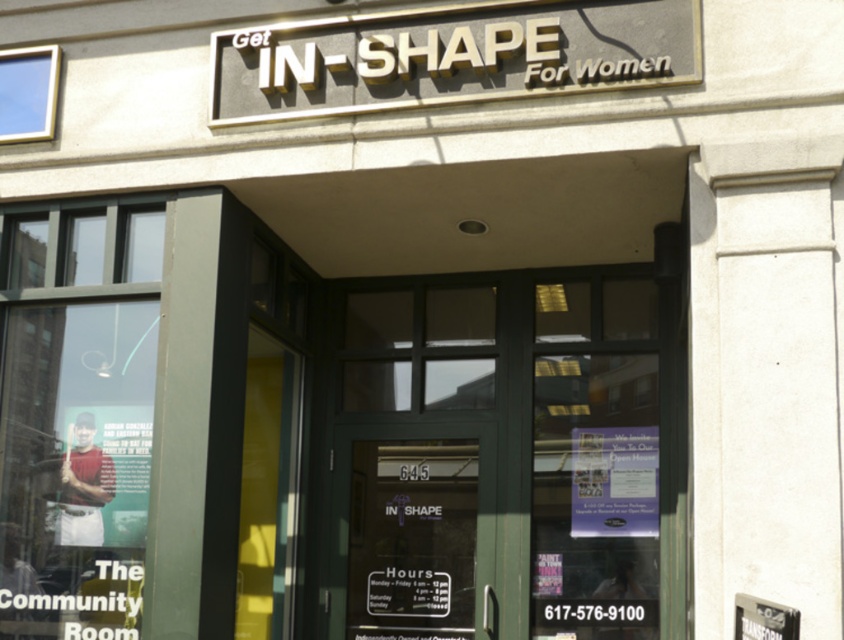
Based on the photo, you are a visitor approaching the entrance of the fitness center. You see the gold metallic sign at upper center and the green glass door at center. Which object is closer to you as you approach the entrance?

The gold metallic sign at upper center is closer to you because it is in front of the green glass door at center, meaning it is positioned nearer to your viewpoint as you approach the entrance.